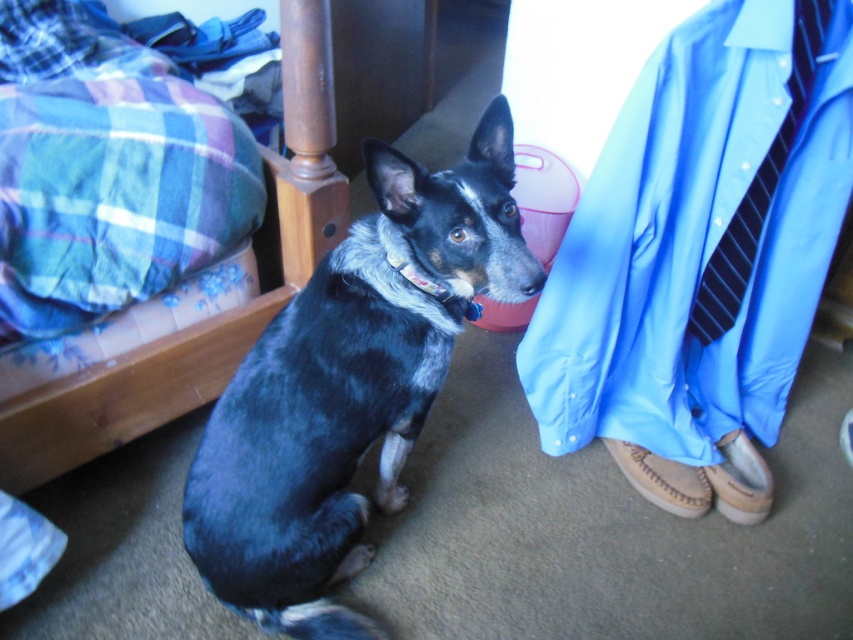
Question: Based on their relative distances, which object is farther from the blue-black fur dog at center?

Choices:
 (A) black striped tie at right
 (B) plaid fabric bed at left
 (C) brown suede sandal at lower right
 (D) brown leather sandal at lower right

Answer: (D)

Question: Does blue-black fur dog at center have a greater width compared to plaid fabric bed at left?

Choices:
 (A) yes
 (B) no

Answer: (B)

Question: Which of these objects is positioned closest to the plaid fabric bed at left?

Choices:
 (A) brown suede sandal at lower right
 (B) brown leather sandal at lower right
 (C) blue-black fur dog at center
 (D) black striped tie at right

Answer: (C)

Question: Among these points, which one is farthest from the camera?

Choices:
 (A) (734, 486)
 (B) (310, 273)
 (C) (335, 516)

Answer: (A)

Question: Can you confirm if blue-black fur dog at center is smaller than brown suede sandal at lower right?

Choices:
 (A) yes
 (B) no

Answer: (B)

Question: Is black striped tie at right positioned in front of brown suede sandal at lower right?

Choices:
 (A) no
 (B) yes

Answer: (B)